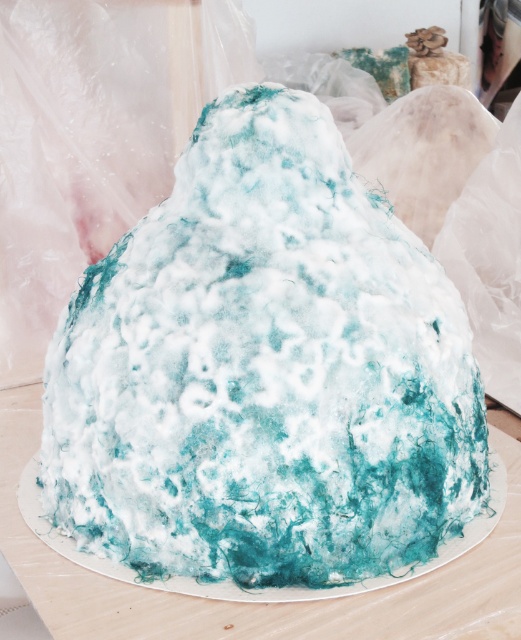
Question: Can you confirm if turquoise felt cake at center is positioned below white textured cake at center?

Choices:
 (A) yes
 (B) no

Answer: (B)

Question: Does turquoise felt cake at center appear under white textured cake at center?

Choices:
 (A) no
 (B) yes

Answer: (A)

Question: Considering the relative positions of turquoise felt cake at center and white textured cake at center in the image provided, where is turquoise felt cake at center located with respect to white textured cake at center?

Choices:
 (A) above
 (B) below

Answer: (A)

Question: Which object is closer to the camera taking this photo?

Choices:
 (A) turquoise felt cake at center
 (B) white textured cake at center

Answer: (B)